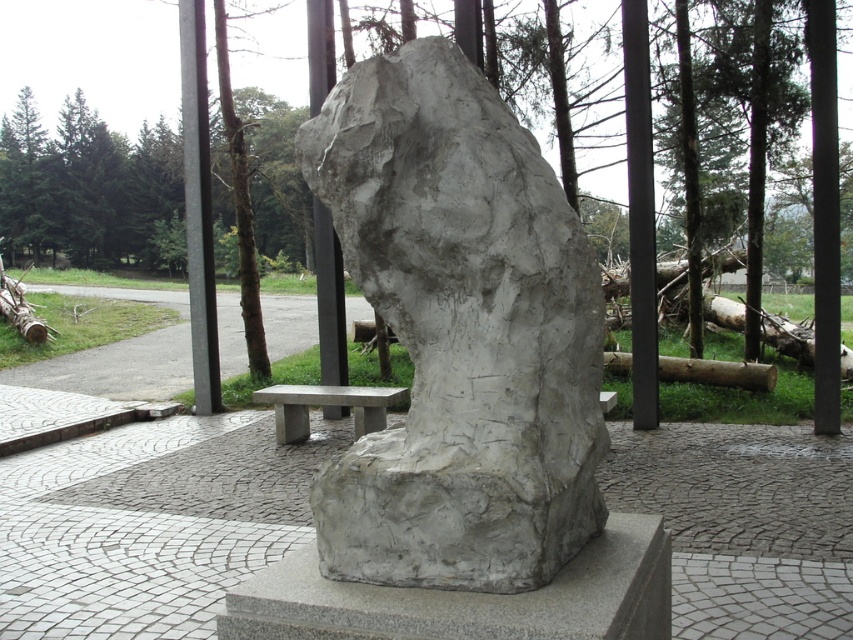
You are an artist planning to install a new sculpture in this outdoor space. You need to ensure that the new sculpture will not block the view of the existing white stone sculpture at center from someone sitting on the smooth concrete bench at center. Given their heights, what should you consider?

The white stone sculpture at center is taller than the smooth concrete bench at center. To avoid blocking the view, the new sculpture should be placed behind or to the side of the existing sculpture so that it doesn

Based on the photo, you are standing in the outdoor area and want to place a small potted plant exactly at the center of the gray granite cement at center. Based on the coordinates provided, where should you place the potted plant?

The gray granite cement at center is located at coordinates point (469, 598), so you should place the potted plant exactly at that point.